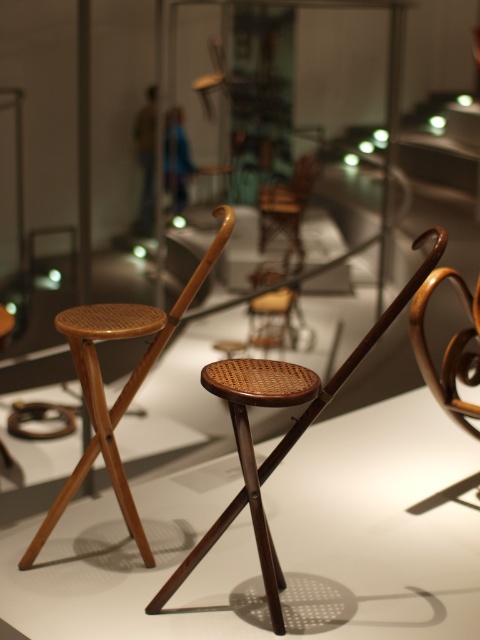
Is point (266, 465) positioned behind point (463, 410)?

No.

Which is behind, point (255, 371) or point (468, 296)?

The point (468, 296) is more distant.

Image resolution: width=480 pixels, height=640 pixels. Identify the location of woven wood folding chair at center. (285, 435).

Does point (393, 305) lie behind point (158, 352)?

No, it is in front of (158, 352).

Between woven wood folding chair at center and woven wood stool at center, which one appears on the left side from the viewer's perspective?

Positioned to the left is woven wood stool at center.

The height and width of the screenshot is (640, 480). Identify the location of woven wood folding chair at center. (285, 435).

Does woven wood stool at center have a lesser height compared to woven wood chair at center?

No, woven wood stool at center is not shorter than woven wood chair at center.

Can you confirm if woven wood stool at center is taller than woven wood chair at center?

Correct, woven wood stool at center is much taller as woven wood chair at center.

Who is more forward, (88, 307) or (302, 188)?

Point (88, 307) is in front.

The width and height of the screenshot is (480, 640). I want to click on woven wood stool at center, so click(x=121, y=388).